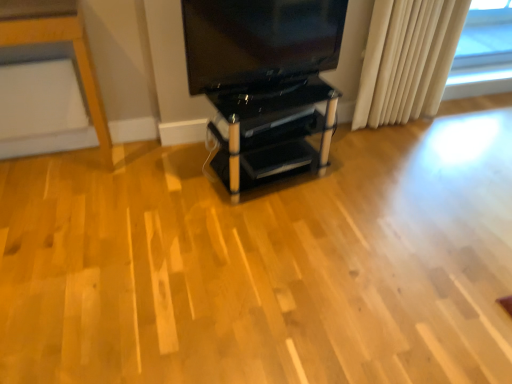
Image resolution: width=512 pixels, height=384 pixels. In order to click on vacant space underneath matte black tv at upper center (from a real-world perspective) in this screenshot , I will do `click(254, 86)`.